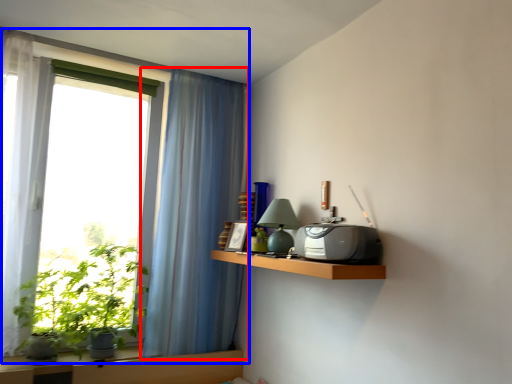
Question: Among these objects, which one is nearest to the camera, curtain (highlighted by a red box) or window (highlighted by a blue box)?

Choices:
 (A) curtain
 (B) window

Answer: (B)